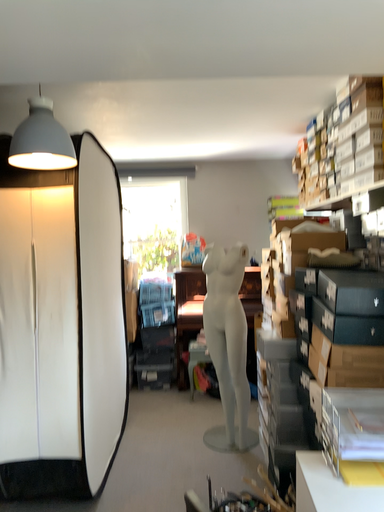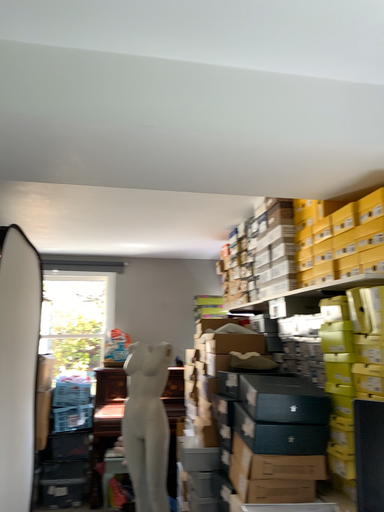
Question: How did the camera likely rotate when shooting the video?

Choices:
 (A) rotated upward
 (B) rotated downward

Answer: (A)